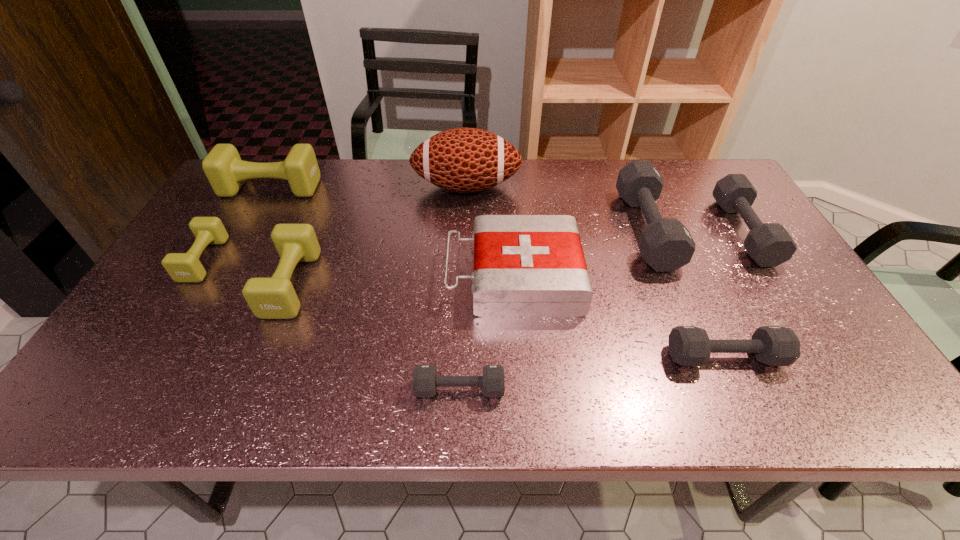
This screenshot has height=540, width=960. In order to click on free space located 0.340m on the left of the third farthest gray dumbbell in this screenshot , I will do `click(515, 356)`.

Locate an element on the screen. vacant region located on the front of the smallest olive dumbbell is located at coordinates (x=132, y=373).

You are a GUI agent. You are given a task and a screenshot of the screen. Output one action in this format:
    pyautogui.click(x=<x>, y=<y>)
    Task: Click on the vacant region located 0.360m on the right of the leftmost gray dumbbell
    
    Given the screenshot: What is the action you would take?
    pyautogui.click(x=678, y=389)

Locate an element on the screen. football situated at the far edge is located at coordinates (466, 160).

The height and width of the screenshot is (540, 960). I want to click on object at the near edge, so click(425, 380).

Where is `object located at the far left corner`? This screenshot has height=540, width=960. object located at the far left corner is located at coordinates (223, 167).

Where is `object located at the far right corner`? object located at the far right corner is located at coordinates (769, 244).

Where is `vacant space at the far edge of the desktop`? The width and height of the screenshot is (960, 540). vacant space at the far edge of the desktop is located at coordinates (563, 192).

Find the location of a particular element. The height and width of the screenshot is (540, 960). free region at the near edge of the desktop is located at coordinates (741, 390).

Locate an element on the screen. Image resolution: width=960 pixels, height=540 pixels. vacant space at the left edge of the desktop is located at coordinates (100, 370).